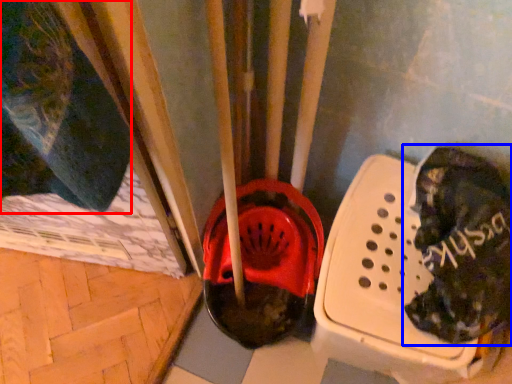
Question: Which of the following is the farthest to the observer, clothing (highlighted by a red box) or footwear (highlighted by a blue box)?

Choices:
 (A) clothing
 (B) footwear

Answer: (B)